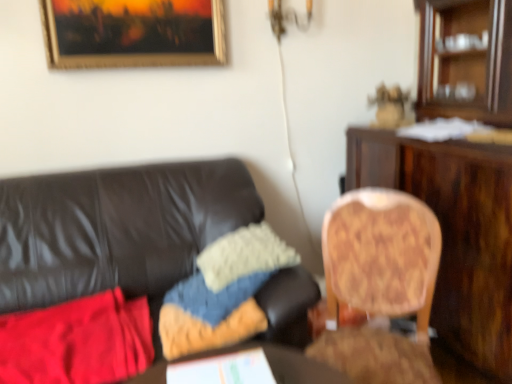
Question: Does wooden round table at center have a greater height compared to red fabric at left?

Choices:
 (A) yes
 (B) no

Answer: (B)

Question: From the image's perspective, is wooden round table at center below red fabric at left?

Choices:
 (A) no
 (B) yes

Answer: (A)

Question: Can you confirm if wooden round table at center is wider than red fabric at left?

Choices:
 (A) no
 (B) yes

Answer: (A)

Question: Can you confirm if wooden round table at center is positioned to the right of red fabric at left?

Choices:
 (A) yes
 (B) no

Answer: (A)

Question: Does wooden round table at center lie behind red fabric at left?

Choices:
 (A) yes
 (B) no

Answer: (B)

Question: Considering the relative sizes of wooden round table at center and red fabric at left in the image provided, is wooden round table at center thinner than red fabric at left?

Choices:
 (A) yes
 (B) no

Answer: (A)

Question: Is gold-framed painting at upper center positioned with its back to red fabric at left?

Choices:
 (A) no
 (B) yes

Answer: (A)

Question: From the image's perspective, is gold-framed painting at upper center above red fabric at left?

Choices:
 (A) no
 (B) yes

Answer: (B)

Question: Is gold-framed painting at upper center not close to red fabric at left?

Choices:
 (A) no
 (B) yes

Answer: (B)

Question: Does gold-framed painting at upper center appear on the right side of red fabric at left?

Choices:
 (A) yes
 (B) no

Answer: (A)

Question: Does gold-framed painting at upper center have a larger size compared to red fabric at left?

Choices:
 (A) yes
 (B) no

Answer: (B)

Question: Considering the relative positions of gold-framed painting at upper center and red fabric at left in the image provided, is gold-framed painting at upper center to the left of red fabric at left from the viewer's perspective?

Choices:
 (A) yes
 (B) no

Answer: (B)

Question: Is wooden round table at center positioned in front of wooden cabinet at upper right?

Choices:
 (A) yes
 (B) no

Answer: (A)